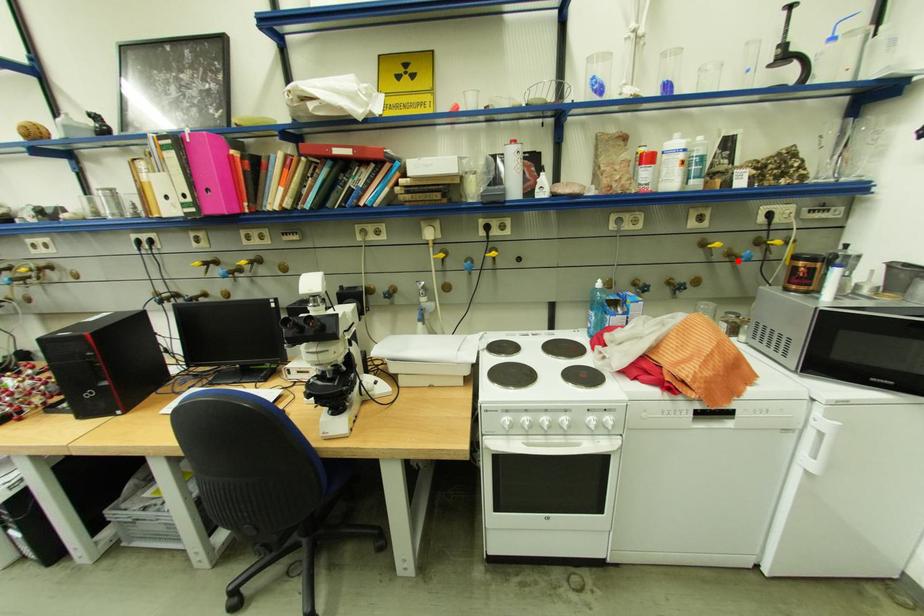
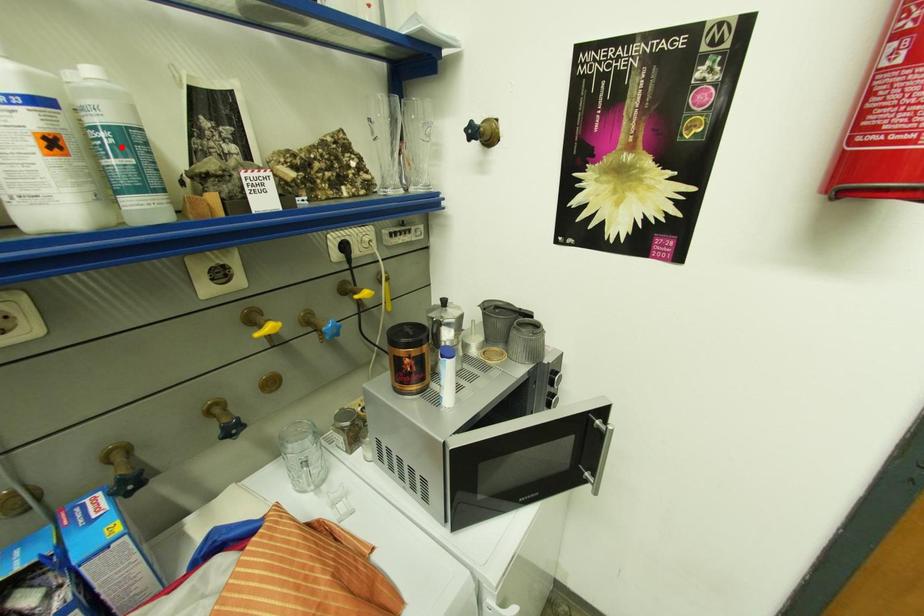
I am providing you with two images of the same scene from different viewpoints. A red point is marked on the first image and another point is marked on the second image. Is the marked point in image1 the same physical position as the marked point in image2?

No